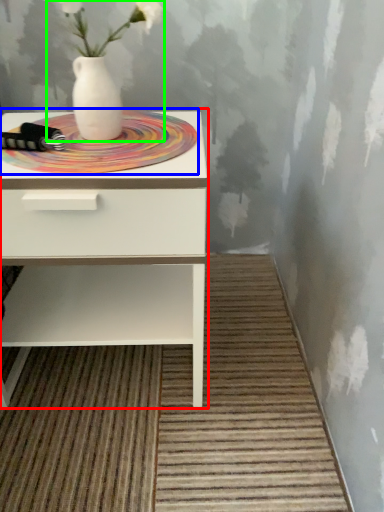
Question: Considering the real-world distances, which object is closest to nightstand (highlighted by a red box)? mat (highlighted by a blue box) or floral arrangement (highlighted by a green box).

Choices:
 (A) mat
 (B) floral arrangement

Answer: (A)